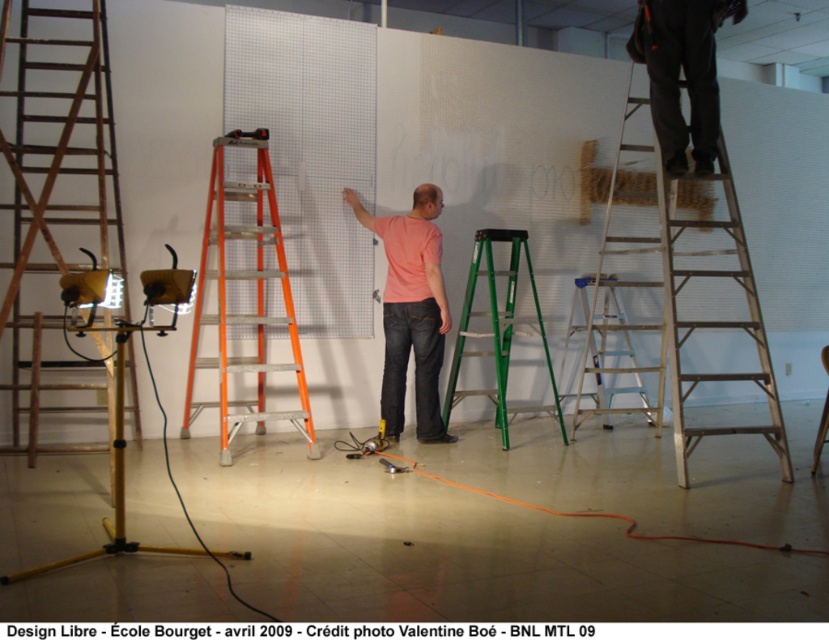
Which is more to the left, wooden ladder at left or pink matte shirt at center?

wooden ladder at left

Identify the location of wooden ladder at left. This screenshot has width=829, height=640. (54, 218).

Is orange aluminum ladder at center-left below wooden stool at center?

No, orange aluminum ladder at center-left is not below wooden stool at center.

Does orange aluminum ladder at center-left have a lesser height compared to wooden stool at center?

In fact, orange aluminum ladder at center-left may be taller than wooden stool at center.

I want to click on orange aluminum ladder at center-left, so click(x=246, y=296).

Does wooden ladder at left have a lesser width compared to green plastic ladder at center?

In fact, wooden ladder at left might be wider than green plastic ladder at center.

Does wooden ladder at left have a greater width compared to green plastic ladder at center?

Indeed, wooden ladder at left has a greater width compared to green plastic ladder at center.

Who is more distant from viewer, (x=22, y=54) or (x=493, y=328)?

The point (x=493, y=328) is more distant.

The image size is (829, 640). What are the coordinates of `wooden ladder at left` in the screenshot? It's located at (54, 218).